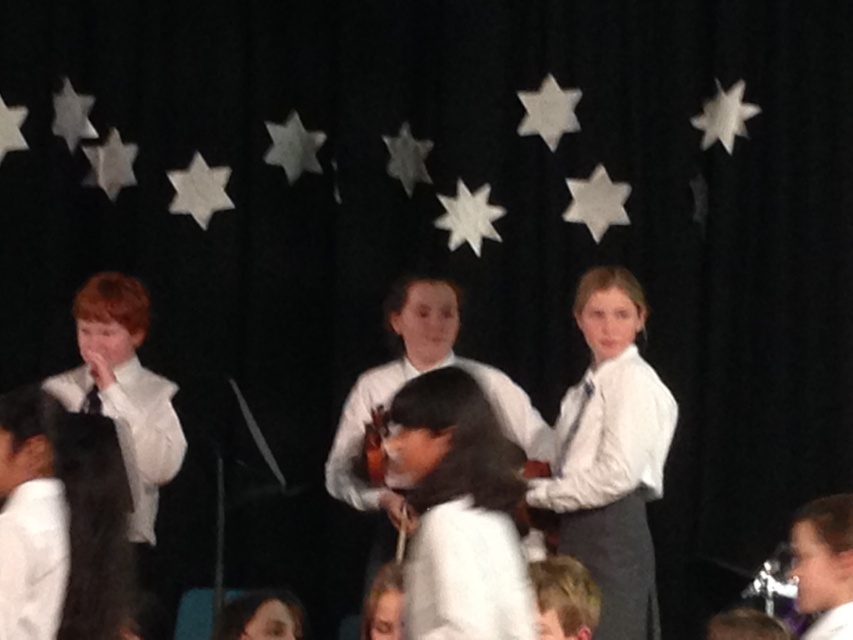
The width and height of the screenshot is (853, 640). What do you see at coordinates (610, 454) in the screenshot?
I see `white satin shirt at center` at bounding box center [610, 454].

Where is `white satin shirt at center`? The width and height of the screenshot is (853, 640). white satin shirt at center is located at coordinates (610, 454).

Is point (651, 492) behind point (846, 609)?

Yes, point (651, 492) is behind point (846, 609).

Between point (566, 460) and point (801, 550), which one is positioned in front?

Positioned in front is point (801, 550).

In order to click on white satin shirt at center in this screenshot , I will do `click(610, 454)`.

Measure the distance from white shirt at lower left to smooth brown hair at center.

They are 2.13 meters apart.

Describe the element at coordinates (30, 516) in the screenshot. I see `white shirt at lower left` at that location.

Who is more distant from viewer, (47, 520) or (849, 580)?

The point (849, 580) is more distant.

You are a GUI agent. You are given a task and a screenshot of the screen. Output one action in this format:
    pyautogui.click(x=<x>, y=<y>)
    Task: Click on the white shirt at lower left
    This screenshot has height=640, width=853.
    Given the screenshot: What is the action you would take?
    pyautogui.click(x=30, y=516)